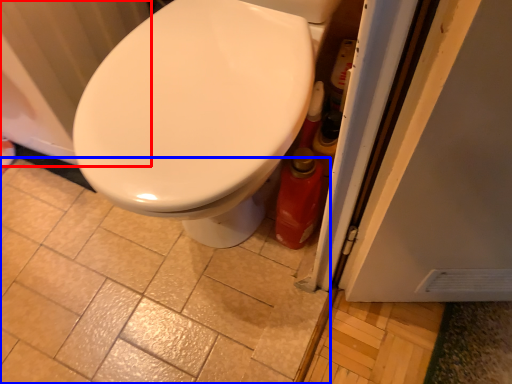
Question: Which object is closer to the camera taking this photo, radiator (highlighted by a red box) or ceramic tile (highlighted by a blue box)?

Choices:
 (A) radiator
 (B) ceramic tile

Answer: (A)